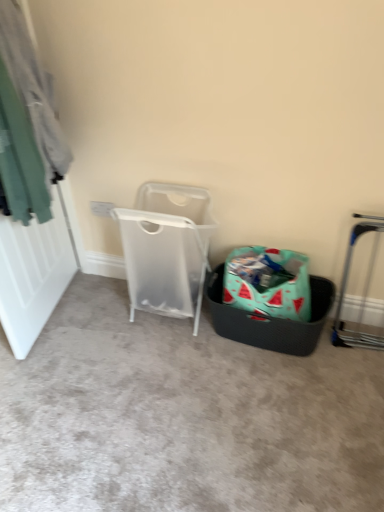
Find the location of `silver metallic trolley at right`. silver metallic trolley at right is located at coordinates (364, 289).

Identify the location of teal fabric at left. (33, 89).

Describe the element at coordinates (167, 249) in the screenshot. I see `transparent plastic laundry basket at center` at that location.

Locate an element on the screen. The image size is (384, 512). silver metallic trolley at right is located at coordinates (364, 289).

How much distance is there between transparent plastic laundry basket at center and watermelon-patterned fabric shopping bag at center?

transparent plastic laundry basket at center and watermelon-patterned fabric shopping bag at center are 13.54 inches apart from each other.

Does point (201, 234) come behind point (306, 291)?

No, (201, 234) is closer to viewer.

Where is `waste container that appears in front of the watermelon-patterned fabric shopping bag at center`? The image size is (384, 512). waste container that appears in front of the watermelon-patterned fabric shopping bag at center is located at coordinates (167, 249).

From a real-world perspective, between transparent plastic laundry basket at center and watermelon-patterned fabric shopping bag at center, who is vertically higher?

transparent plastic laundry basket at center, from a real-world perspective.

From a real-world perspective, is transparent plastic laundry basket at center on top of black textured basket at center?

Yes, from a real-world perspective, transparent plastic laundry basket at center is on top of black textured basket at center.

From the image's perspective, between transparent plastic laundry basket at center and black textured basket at center, who is located below?

black textured basket at center, from the image's perspective.

Is transparent plastic laundry basket at center not inside black textured basket at center?

Indeed, transparent plastic laundry basket at center is completely outside black textured basket at center.

Can you tell me how much black textured basket at center and teal fabric at left differ in facing direction?

The angle between the facing direction of black textured basket at center and the facing direction of teal fabric at left is 84 degrees.

Considering the relative sizes of black textured basket at center and teal fabric at left in the image provided, is black textured basket at center wider than teal fabric at left?

Indeed, black textured basket at center has a greater width compared to teal fabric at left.

From the image's perspective, is black textured basket at center beneath teal fabric at left?

Correct, black textured basket at center appears lower than teal fabric at left in the image.

Which is farther, (69,450) or (15,46)?

Point (69,450)

Looking at this image, is black textured basket at center positioned with its back to teal woven basket at lower right?

That's not correct — black textured basket at center is not looking away from teal woven basket at lower right.

From a real-world perspective, is black textured basket at center physically below teal woven basket at lower right?

Correct, in the physical world, black textured basket at center is lower than teal woven basket at lower right.

How much distance is there between black textured basket at center and teal woven basket at lower right?

15.28 inches.

Is black textured basket at center wider than teal woven basket at lower right?

Yes.

How different are the orientations of transparent plastic laundry basket at center and silver metallic trolley at right in degrees?

The facing directions of transparent plastic laundry basket at center and silver metallic trolley at right are 2.47 degrees apart.

Are transparent plastic laundry basket at center and silver metallic trolley at right located far from each other?

No, transparent plastic laundry basket at center is in close proximity to silver metallic trolley at right.

From a real-world perspective, is transparent plastic laundry basket at center beneath silver metallic trolley at right?

Actually, transparent plastic laundry basket at center is physically above silver metallic trolley at right in the real world.

Can you tell me how much transparent plastic laundry basket at center and teal fabric at left differ in facing direction?

There is a 99.7-degree angle between the facing directions of transparent plastic laundry basket at center and teal fabric at left.

From the image's perspective, which one is positioned higher, transparent plastic laundry basket at center or teal fabric at left?

teal fabric at left appears higher in the image.

Are transparent plastic laundry basket at center and teal fabric at left located far from each other?

No, transparent plastic laundry basket at center is not far from teal fabric at left.

Relative to teal fabric at left, is transparent plastic laundry basket at center in front or behind?

transparent plastic laundry basket at center is behind teal fabric at left.

Which of these two, teal fabric at left or silver metallic trolley at right, is bigger?

With larger size is teal fabric at left.

In the scene shown: How many degrees apart are the facing directions of teal fabric at left and silver metallic trolley at right?

teal fabric at left and silver metallic trolley at right are facing 97.3 degrees away from each other.

Which of these two, teal fabric at left or silver metallic trolley at right, stands shorter?

Standing shorter between the two is silver metallic trolley at right.

Can you confirm if teal fabric at left is positioned to the left of silver metallic trolley at right?

Indeed, teal fabric at left is positioned on the left side of silver metallic trolley at right.

This screenshot has width=384, height=512. In order to click on waste container above the watermelon-patterned fabric shopping bag at center (from a real-world perspective) in this screenshot , I will do `click(167, 249)`.

In order to click on waste container behind the black textured basket at center in this screenshot , I will do click(167, 249).

When comparing their distances from teal woven basket at lower right, does teal fabric at left or watermelon-patterned fabric shopping bag at center seem closer?

watermelon-patterned fabric shopping bag at center.

Looking at this image, considering their positions, is teal woven basket at lower right positioned further to black textured basket at center than transparent plastic laundry basket at center?

transparent plastic laundry basket at center is further to black textured basket at center.

Which object lies nearer to the anchor point transparent plastic laundry basket at center, watermelon-patterned fabric shopping bag at center or teal woven basket at lower right?

Based on the image, teal woven basket at lower right appears to be nearer to transparent plastic laundry basket at center.

Based on the photo, when comparing their distances from watermelon-patterned fabric shopping bag at center, does teal fabric at left or transparent plastic laundry basket at center seem closer?

transparent plastic laundry basket at center is positioned closer to the anchor watermelon-patterned fabric shopping bag at center.

Based on their spatial positions, is black textured basket at center or teal fabric at left further from teal woven basket at lower right?

The object further to teal woven basket at lower right is teal fabric at left.

From the image, which object appears to be farther from watermelon-patterned fabric shopping bag at center, black textured basket at center or teal fabric at left?

Based on the image, teal fabric at left appears to be further to watermelon-patterned fabric shopping bag at center.

Which object lies nearer to the anchor point silver metallic trolley at right, teal woven basket at lower right or watermelon-patterned fabric shopping bag at center?

teal woven basket at lower right is positioned closer to the anchor silver metallic trolley at right.

Consider the image. Estimate the real-world distances between objects in this image. Which object is closer to black textured basket at center, transparent plastic laundry basket at center or silver metallic trolley at right?

Among the two, transparent plastic laundry basket at center is located nearer to black textured basket at center.

You are a GUI agent. You are given a task and a screenshot of the screen. Output one action in this format:
    pyautogui.click(x=<x>, y=<y>)
    Task: Click on the waste container situated between teal fabric at left and teal woven basket at lower right from left to right
    The image size is (384, 512).
    Given the screenshot: What is the action you would take?
    pyautogui.click(x=167, y=249)

Locate an element on the screen. waste container between black textured basket at center and teal woven basket at lower right from front to back is located at coordinates (167, 249).

Identify the location of shopping bag between transparent plastic laundry basket at center and silver metallic trolley at right in the horizontal direction. This screenshot has width=384, height=512. (268, 282).

At what (x,y) coordinates should I click in order to perform the action: click on shopping basket located between teal fabric at left and silver metallic trolley at right in the left-right direction. Please return your answer as a coordinate pair (x, y). The width and height of the screenshot is (384, 512). Looking at the image, I should click on (270, 319).